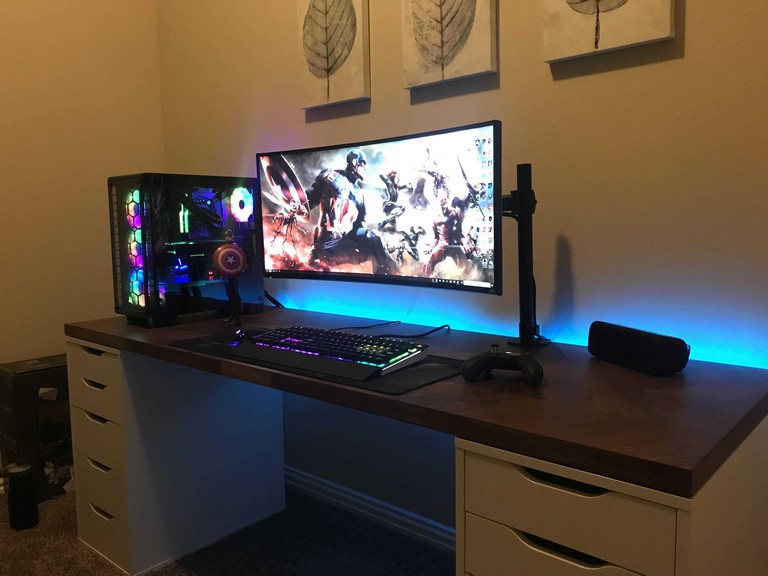
Locate an element on the screen. The image size is (768, 576). keyboard is located at coordinates (356, 340).